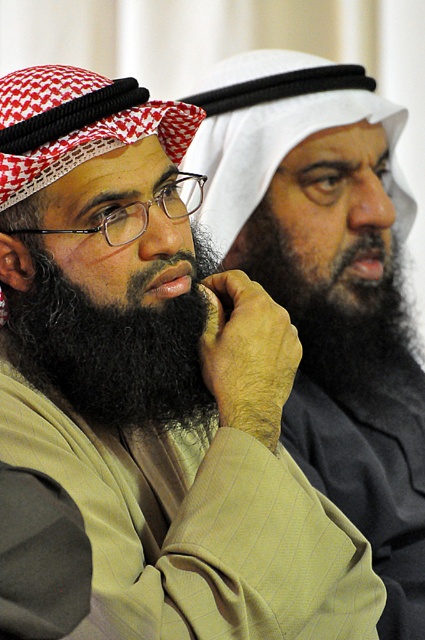
Question: Which object is farther from the camera taking this photo?

Choices:
 (A) matte black beard at center
 (B) blackwoollybeard at left
 (C) black fuzzy beard at center

Answer: (C)

Question: Does matte black beard at center appear under black fuzzy beard at center?

Choices:
 (A) no
 (B) yes

Answer: (B)

Question: Can you confirm if blackwoollybeard at left is positioned above black fuzzy beard at center?

Choices:
 (A) no
 (B) yes

Answer: (A)

Question: Is blackwoollybeard at left smaller than black fuzzy beard at center?

Choices:
 (A) yes
 (B) no

Answer: (A)

Question: Which object appears farthest from the camera in this image?

Choices:
 (A) matte black beard at center
 (B) black fuzzy beard at center
 (C) blackwoollybeard at left

Answer: (B)

Question: Which of these objects is positioned farthest from the blackwoollybeard at left?

Choices:
 (A) matte black beard at center
 (B) black fuzzy beard at center

Answer: (A)